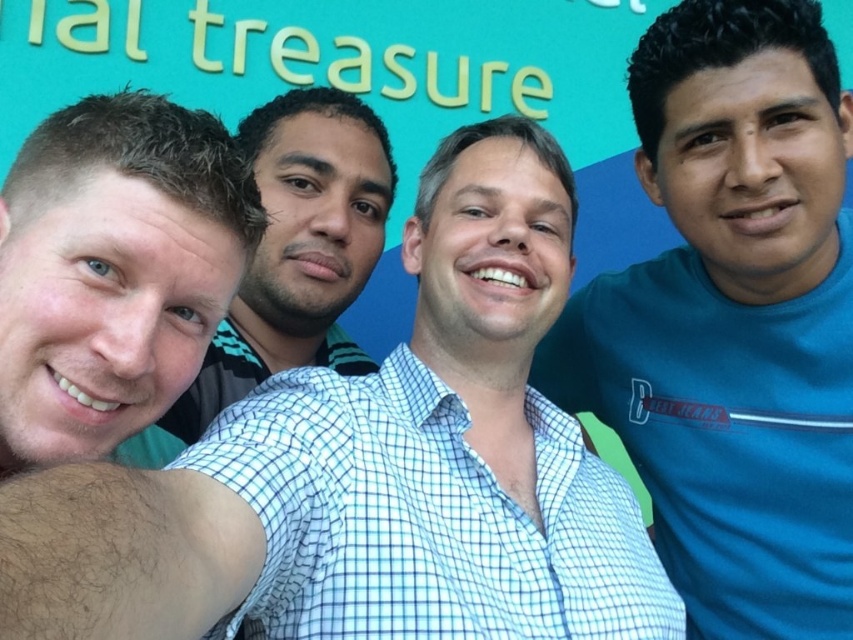
The width and height of the screenshot is (853, 640). Describe the element at coordinates (373, 468) in the screenshot. I see `blue checkered shirt at center` at that location.

Measure the distance between point (x=440, y=262) and camera.

Result: 14.68 feet

The width and height of the screenshot is (853, 640). I want to click on blue checkered shirt at center, so click(373, 468).

This screenshot has height=640, width=853. In order to click on blue checkered shirt at center in this screenshot , I will do `click(373, 468)`.

Between point (469, 291) and point (270, 284), which one is positioned in front?

Point (469, 291) is in front.

Can you confirm if blue checkered shirt at center is shorter than white checkered shirt at center?

Incorrect, blue checkered shirt at center's height does not fall short of white checkered shirt at center's.

Is point (517, 269) positioned after point (247, 307)?

No, it is in front of (247, 307).

Identify the location of blue checkered shirt at center. 373,468.

Describe the element at coordinates (732, 321) in the screenshot. I see `blue cotton shirt at center` at that location.

Does blue cotton shirt at center come behind white checkered shirt at center?

Yes, blue cotton shirt at center is behind white checkered shirt at center.

Does point (819, 464) come farther from viewer compared to point (149, 429)?

That is True.

Image resolution: width=853 pixels, height=640 pixels. What are the coordinates of `blue cotton shirt at center` in the screenshot? It's located at (732, 321).